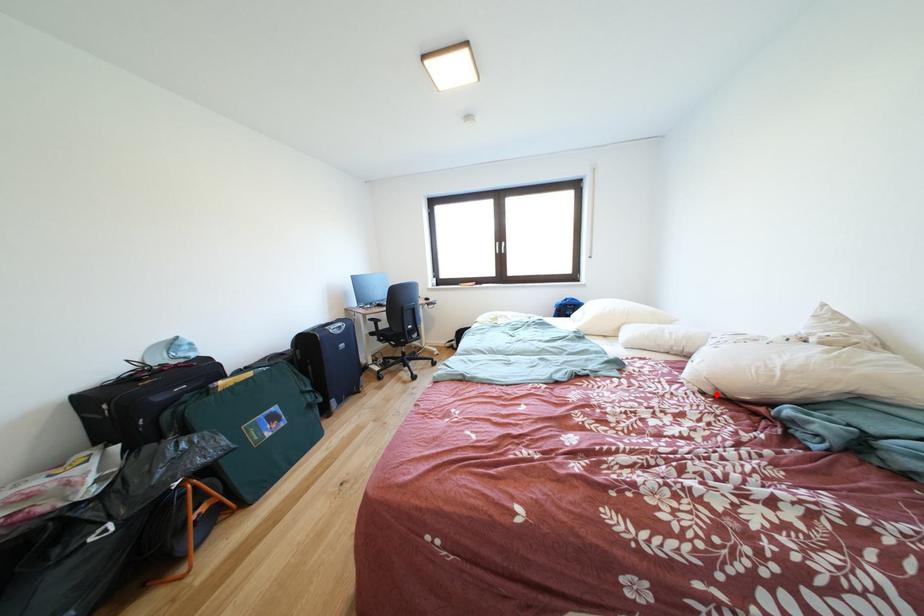
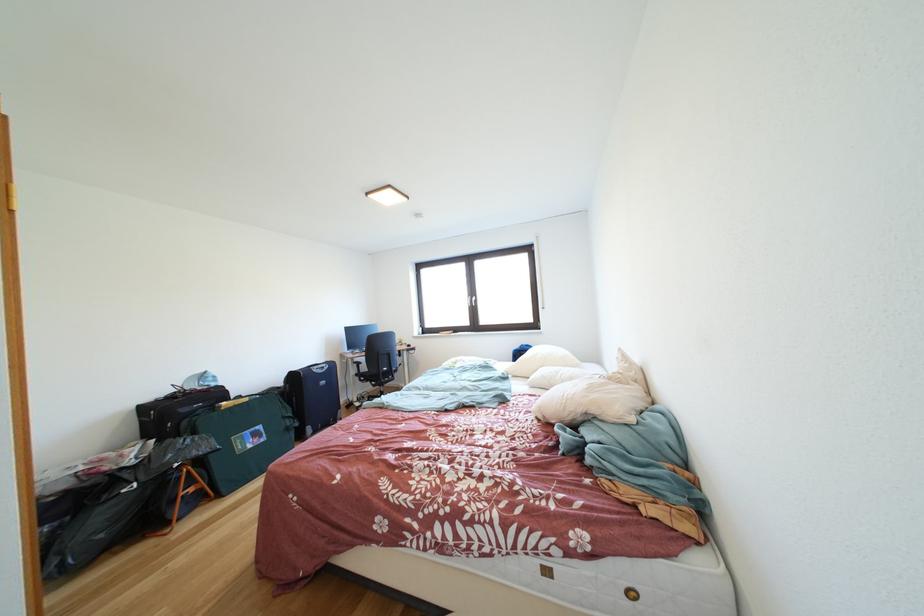
Where in the second image is the point corresponding to the highlighted location from the first image?

(549, 421)